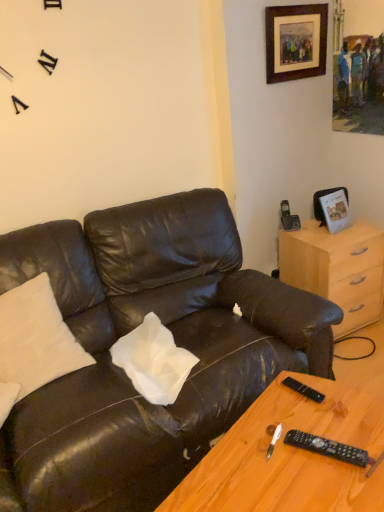
Question: Is matte black leather couch at center wider or thinner than black plastic remote at lower right, positioned as the 2th remote in bottom-to-top order?

Choices:
 (A) wide
 (B) thin

Answer: (A)

Question: Do you think matte black leather couch at center is within black plastic remote at lower right, positioned as the 2th remote in bottom-to-top order, or outside of it?

Choices:
 (A) outside
 (B) inside

Answer: (A)

Question: Which object is the farthest from the white soft pillow at upper left?

Choices:
 (A) wooden table at lower right
 (B) matte black leather couch at center
 (C) black plastic remote at lower right, which is the second remote from top to bottom
 (D) light wood/finish dresser at right
 (E) wooden framed artwork at upper right, the second picture frame in the bottom-to-top sequence

Answer: (E)

Question: Considering the real-world distances, which object is farthest from the wooden table at lower right?

Choices:
 (A) wooden framed artwork at upper right, the 1th picture frame in the top-to-bottom sequence
 (B) black plastic remote at lower right, arranged as the 1th remote when viewed from the back
 (C) black plastic remote at lower right, acting as the second remote starting from the back
 (D) light wood/finish dresser at right
 (E) white soft pillow at upper left

Answer: (A)